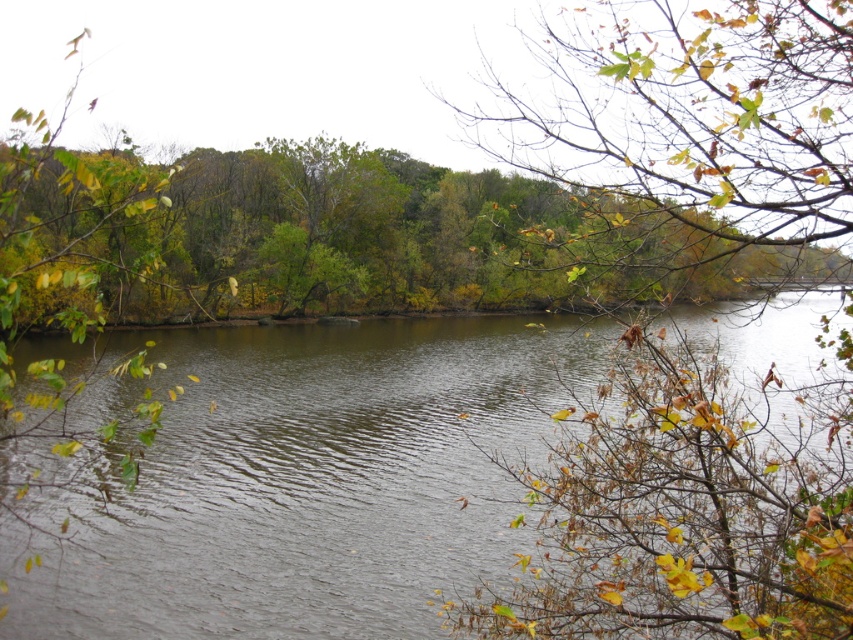
Question: Is dark brown water at center below green leafy tree at upper center?

Choices:
 (A) no
 (B) yes

Answer: (B)

Question: Does dark brown water at center appear over green matte leaves at upper right?

Choices:
 (A) yes
 (B) no

Answer: (B)

Question: Which point appears closest to the camera in this image?

Choices:
 (A) (558, 406)
 (B) (782, 493)

Answer: (B)

Question: Which point appears farthest from the camera in this image?

Choices:
 (A) (755, 611)
 (B) (390, 186)
 (C) (558, 321)

Answer: (B)

Question: From the image, what is the correct spatial relationship of dark brown water at center in relation to green leafy tree at upper center?

Choices:
 (A) left
 (B) right

Answer: (B)

Question: Estimate the real-world distances between objects in this image. Which object is closer to the dark brown water at center?

Choices:
 (A) green matte leaves at upper right
 (B) green leafy tree at upper center

Answer: (B)